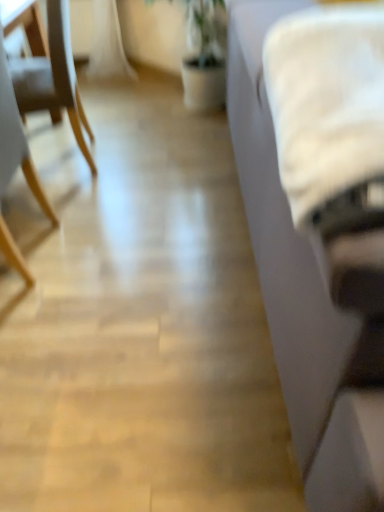
The width and height of the screenshot is (384, 512). In order to click on free region under light wood chair at left, which appears as the 1th chair when viewed from the back (from a real-world perspective) in this screenshot , I will do `click(67, 161)`.